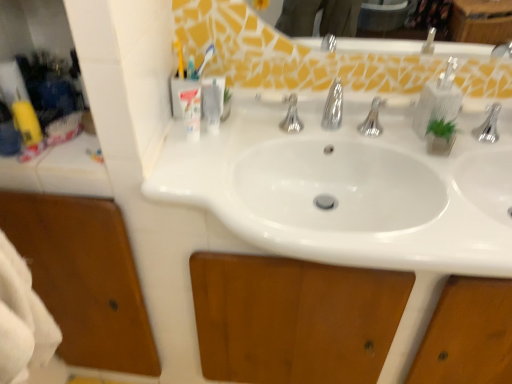
This screenshot has height=384, width=512. Find the location of `vacant space to the right of translucent plastic toothbrush holder at upper left, acting as the second toiletry starting from the right`. vacant space to the right of translucent plastic toothbrush holder at upper left, acting as the second toiletry starting from the right is located at coordinates (245, 142).